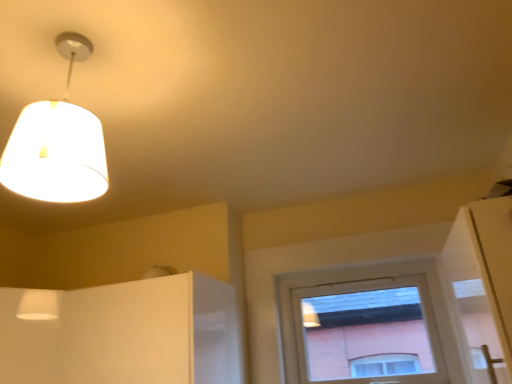
Question: From a real-world perspective, is white fabric lampshade at upper left under white glossy cabinet at lower left?

Choices:
 (A) yes
 (B) no

Answer: (B)

Question: Is white fabric lampshade at upper left facing towards white glossy cabinet at lower left?

Choices:
 (A) yes
 (B) no

Answer: (B)

Question: Considering the relative sizes of white fabric lampshade at upper left and white glossy cabinet at lower left in the image provided, is white fabric lampshade at upper left shorter than white glossy cabinet at lower left?

Choices:
 (A) no
 (B) yes

Answer: (B)

Question: Is white fabric lampshade at upper left facing away from white glossy cabinet at lower left?

Choices:
 (A) no
 (B) yes

Answer: (B)

Question: Is white fabric lampshade at upper left smaller than white glossy cabinet at lower left?

Choices:
 (A) no
 (B) yes

Answer: (B)

Question: Would you say white glossy cabinet at lower left is to the left or to the right of matte white window at center in the picture?

Choices:
 (A) left
 (B) right

Answer: (A)

Question: From a real-world perspective, is white glossy cabinet at lower left above or below matte white window at center?

Choices:
 (A) below
 (B) above

Answer: (A)

Question: From their relative heights in the image, would you say white glossy cabinet at lower left is taller or shorter than matte white window at center?

Choices:
 (A) short
 (B) tall

Answer: (A)

Question: Looking at the image, does white glossy cabinet at lower left seem bigger or smaller compared to matte white window at center?

Choices:
 (A) small
 (B) big

Answer: (B)

Question: From their relative heights in the image, would you say white glossy cabinet at lower left is taller or shorter than white fabric lampshade at upper left?

Choices:
 (A) short
 (B) tall

Answer: (B)

Question: Would you say white glossy cabinet at lower left is to the left or to the right of white fabric lampshade at upper left in the picture?

Choices:
 (A) right
 (B) left

Answer: (A)

Question: Is white glossy cabinet at lower left bigger or smaller than white fabric lampshade at upper left?

Choices:
 (A) small
 (B) big

Answer: (B)

Question: Relative to white fabric lampshade at upper left, is white glossy cabinet at lower left in front or behind?

Choices:
 (A) behind
 (B) front

Answer: (A)

Question: Considering the positions of matte white window at center and white glossy cabinet at lower left in the image, is matte white window at center wider or thinner than white glossy cabinet at lower left?

Choices:
 (A) wide
 (B) thin

Answer: (B)

Question: Would you say matte white window at center is to the left or to the right of white glossy cabinet at lower left in the picture?

Choices:
 (A) left
 (B) right

Answer: (B)